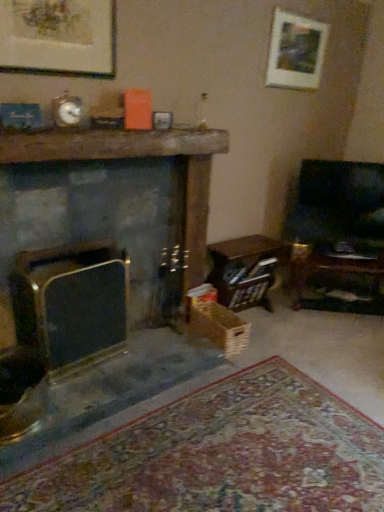
Question: In terms of width, does dark wood rocking chair at right look wider or thinner when compared to wooden crate at lower center?

Choices:
 (A) thin
 (B) wide

Answer: (A)

Question: Considering the positions of dark wood rocking chair at right and wooden crate at lower center in the image, is dark wood rocking chair at right bigger or smaller than wooden crate at lower center?

Choices:
 (A) small
 (B) big

Answer: (B)

Question: Which object is the closest to the dark gray stone fireplace at center, which is the second fireplace in left-to-right order?

Choices:
 (A) wooden crate at lower right
 (B) matte gold picture frame at upper left, which is the 2th picture frame in top-to-bottom order
 (C) matte black fireplace at left, the second fireplace positioned from the right
 (D) white matte picture frame at upper right, the 2th picture frame in the left-to-right sequence
 (E) dark wood rocking chair at right

Answer: (A)

Question: Which of these objects is positioned farthest from the matte black fireplace at left, the second fireplace positioned from the right?

Choices:
 (A) dark wood rocking chair at right
 (B) matte gold picture frame at upper left, which appears as the 2th picture frame when viewed from the right
 (C) white matte picture frame at upper right, the 1th picture frame viewed from the right
 (D) dark gray stone fireplace at center, which is the second fireplace in left-to-right order
 (E) wooden crate at lower right

Answer: (C)